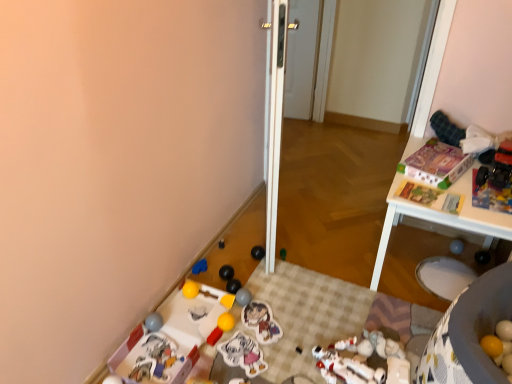
Locate an element on the screen. free space between matte plastic sticker at center, marked as the seventh toy in a right-to-left arrangement, and matte plastic sticker at center, placed as the ninth toy when sorted from right to left is located at coordinates (253, 341).